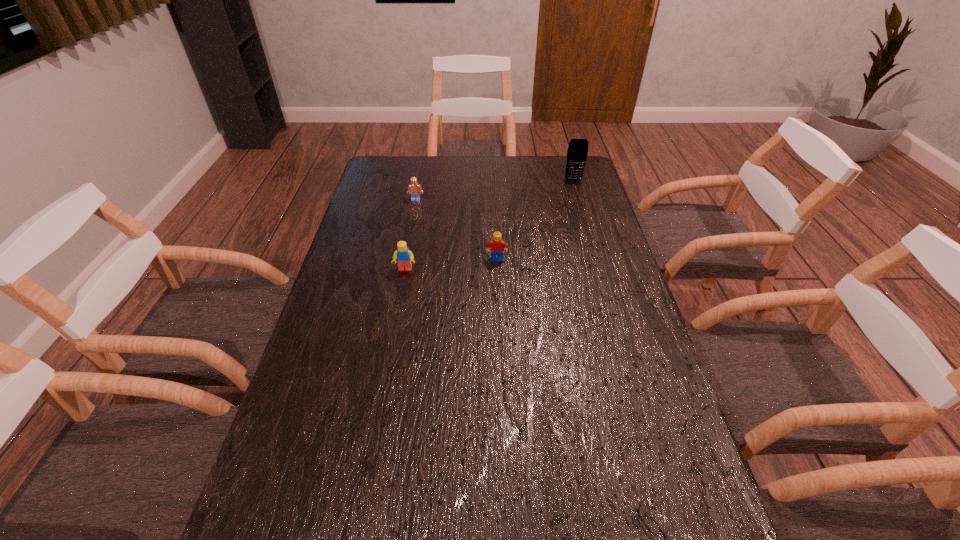
Locate an element on the screen. This screenshot has width=960, height=540. vacant area that lies between the farthest Lego and the second nearest object is located at coordinates (411, 235).

This screenshot has height=540, width=960. Identify the location of object that is the second closest to the farthest Lego. (496, 245).

The height and width of the screenshot is (540, 960). I want to click on object that is the nearest to the rightmost Lego, so click(x=403, y=256).

Identify which Lego is the closest to the fourth nearest object. Please provide its 2D coordinates. Your answer should be formatted as a tuple, i.e. [(x, y)], where the tuple contains the x and y coordinates of a point satisfying the conditions above.

[(403, 256)]

Point out which Lego is positioned as the nearest to the tallest object. Please provide its 2D coordinates. Your answer should be formatted as a tuple, i.e. [(x, y)], where the tuple contains the x and y coordinates of a point satisfying the conditions above.

[(496, 245)]